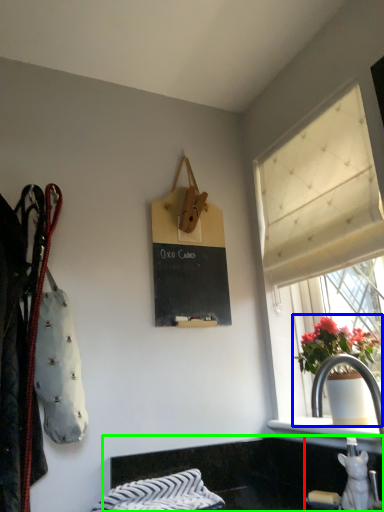
Question: Considering the real-world distances, which object is farthest from sink (highlighted by a red box)? houseplant (highlighted by a blue box) or counter top (highlighted by a green box)?

Choices:
 (A) houseplant
 (B) counter top

Answer: (A)